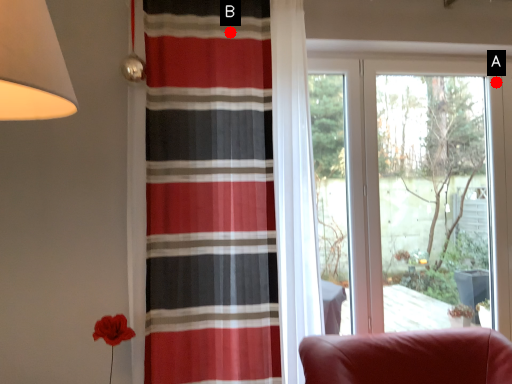
Question: Two points are circled on the image, labeled by A and B beside each circle. Which point appears farthest from the camera in this image?

Choices:
 (A) A is further
 (B) B is further

Answer: (A)